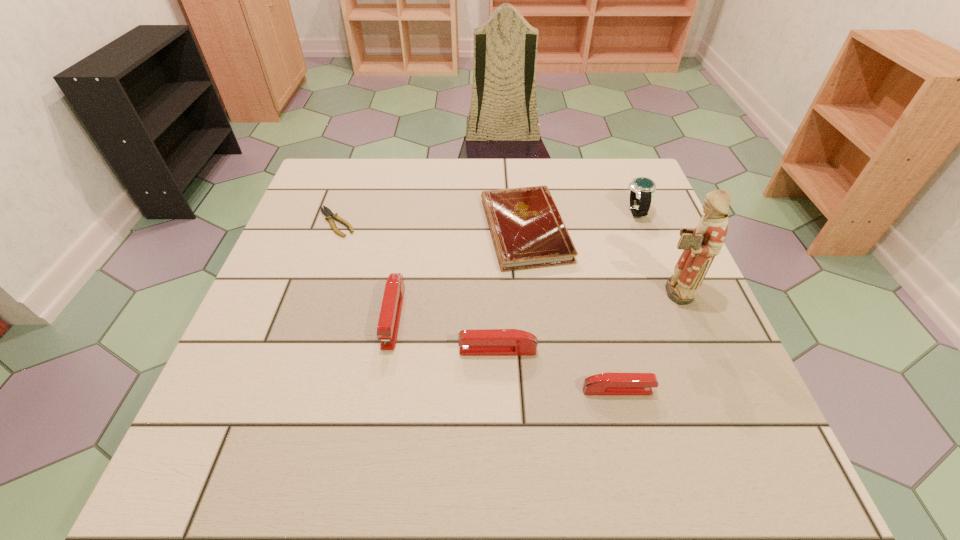
Find the location of a particular element. The width and height of the screenshot is (960, 540). blank space located on the front-facing side of the sixth object from right to left is located at coordinates (384, 373).

At what (x,y) coordinates should I click in order to perform the action: click on vacant position located 0.300m on the front-facing side of the fourth shortest object. Please return your answer as a coordinate pair (x, y). The width and height of the screenshot is (960, 540). Looking at the image, I should click on (305, 350).

Find the location of a particular element. Image resolution: width=960 pixels, height=540 pixels. vacant position located on the front-facing side of the fourth shortest object is located at coordinates (357, 350).

Identify the location of vacant point located 0.400m on the front-facing side of the fourth shortest object. (254, 350).

Image resolution: width=960 pixels, height=540 pixels. In order to click on vacant space located 0.090m on the front-facing side of the rightmost stapler in this screenshot , I will do `click(702, 390)`.

At what (x,y) coordinates should I click in order to perform the action: click on free region located on the right of the pliers. Please return your answer as a coordinate pair (x, y). This screenshot has width=960, height=540. Looking at the image, I should click on (408, 222).

You are a GUI agent. You are given a task and a screenshot of the screen. Output one action in this format:
    pyautogui.click(x=<x>, y=<y>)
    Task: Click on the free space located on the left of the notebook
    
    Given the screenshot: What is the action you would take?
    pyautogui.click(x=414, y=230)

Where is `blank space located 0.320m on the front of the watch`? This screenshot has height=540, width=960. blank space located 0.320m on the front of the watch is located at coordinates (679, 322).

The width and height of the screenshot is (960, 540). Identify the location of free space located on the front-facing side of the tallest object. (502, 291).

Find the location of a particular element. The height and width of the screenshot is (540, 960). vacant space located on the front-facing side of the tallest object is located at coordinates (607, 291).